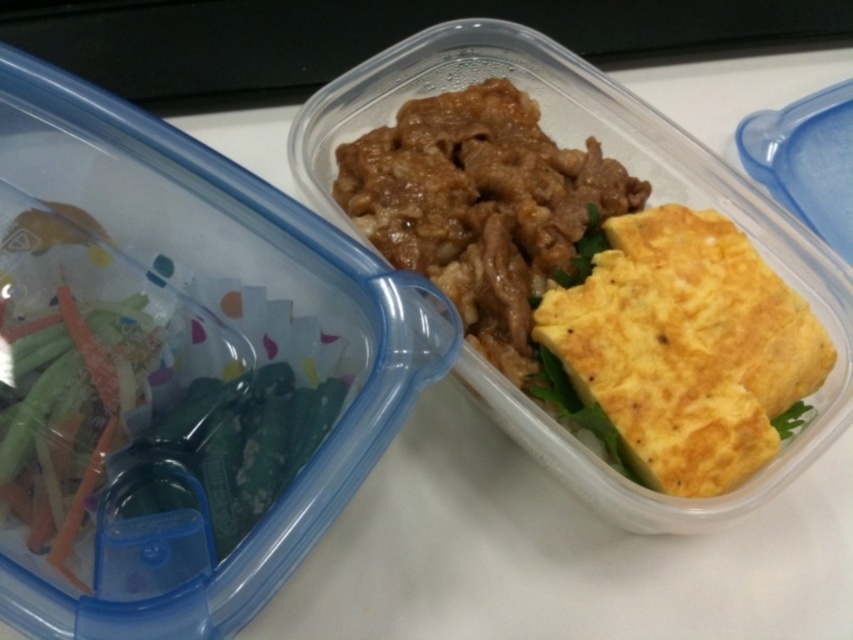
Question: Can you confirm if yellow soft omelet at center right is positioned above brown glossy beef at center?

Choices:
 (A) yes
 (B) no

Answer: (B)

Question: Among these objects, which one is farthest from the camera?

Choices:
 (A) brown glossy beef at center
 (B) yellow soft omelet at center right

Answer: (A)

Question: Does yellow soft omelet at center right appear on the right side of brown glossy beef at center?

Choices:
 (A) yes
 (B) no

Answer: (A)

Question: Does yellow soft omelet at center right have a lesser width compared to brown glossy beef at center?

Choices:
 (A) yes
 (B) no

Answer: (A)